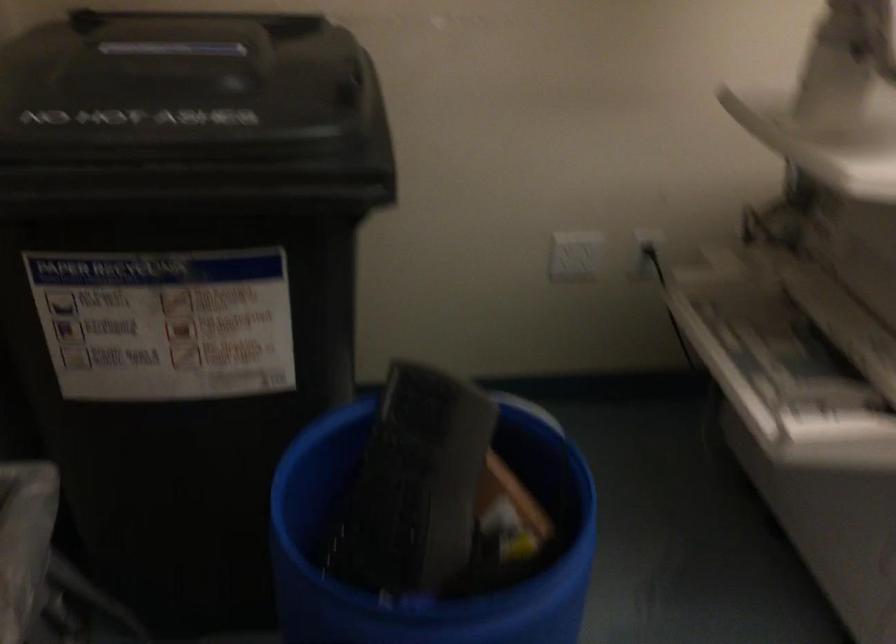
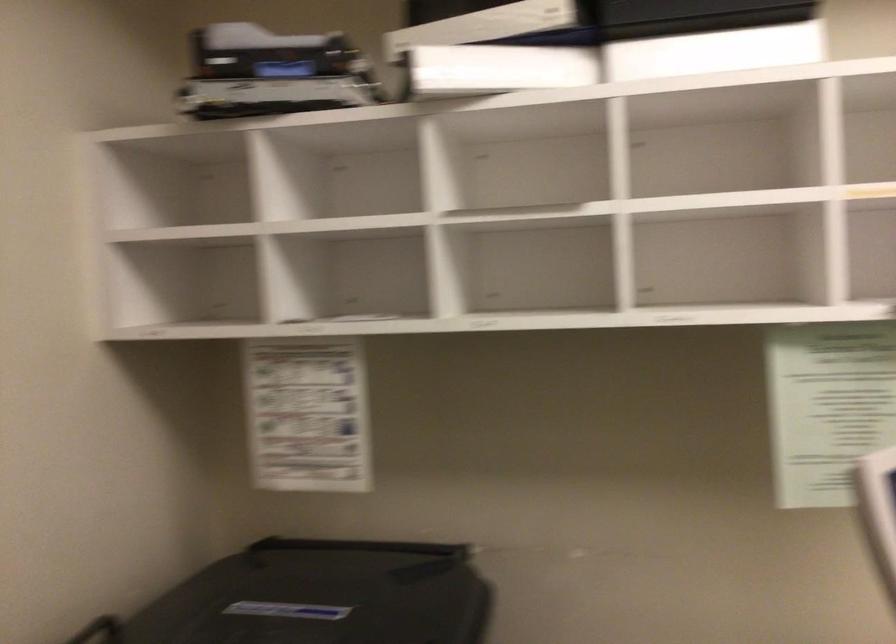
How did the camera likely rotate?

The rotation direction of the camera is left-up.